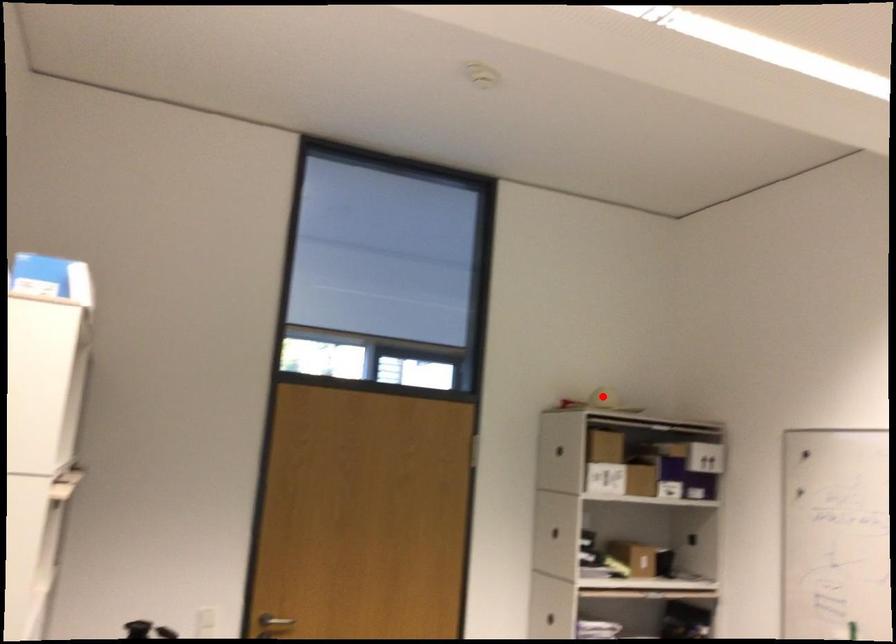
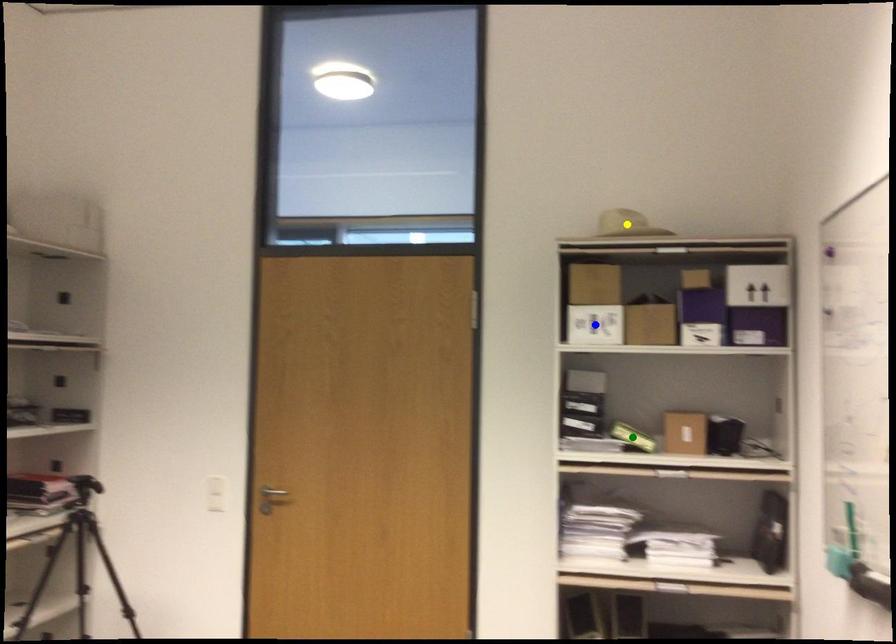
Question: I am providing you with two images of the same scene from different viewpoints. A red point is marked on the first image. You are given multiple points on the second image. Which point in image 2 represents the same 3d spot as the red point in image 1?

Choices:
 (A) blue point
 (B) green point
 (C) yellow point

Answer: (C)